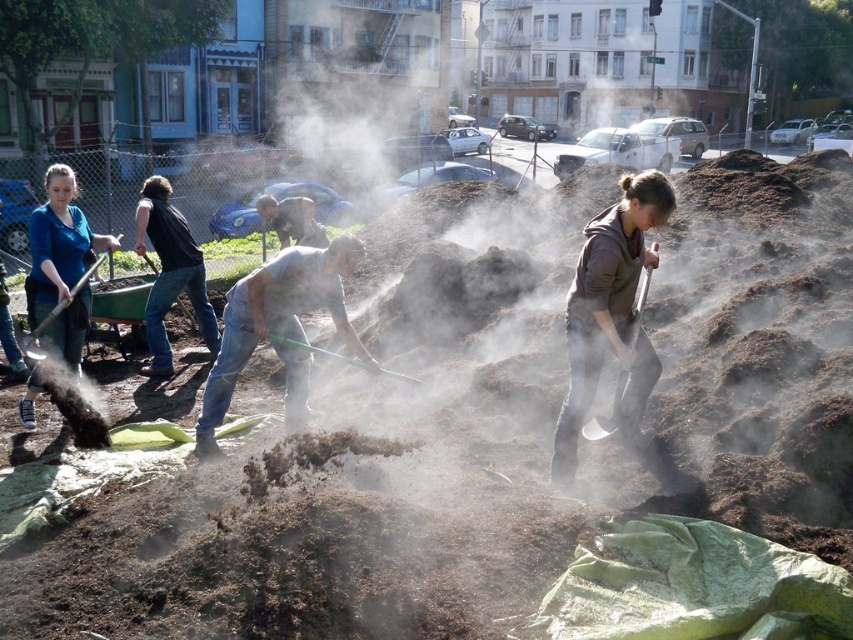
Who is higher up, brown matte jacket at center or black cotton shirt at center?

black cotton shirt at center is higher up.

Identify the location of brown matte jacket at center. This screenshot has height=640, width=853. (610, 308).

Is point (296, 328) positioned behind point (618, 394)?

Yes, it is behind point (618, 394).

Is point (231, 308) closer to viewer compared to point (635, 310)?

No, it is not.

Find the location of a particular element. This screenshot has width=853, height=640. gray matte shirt at center is located at coordinates (276, 317).

Looking at this image, who is more forward, (65,333) or (202,308)?

Point (65,333) is more forward.

Does matte blue shirt at left have a greater width compared to black cotton shirt at center?

Yes.

This screenshot has height=640, width=853. What do you see at coordinates (61, 266) in the screenshot? I see `matte blue shirt at left` at bounding box center [61, 266].

The image size is (853, 640). What are the coordinates of `matte blue shirt at left` in the screenshot? It's located at (61, 266).